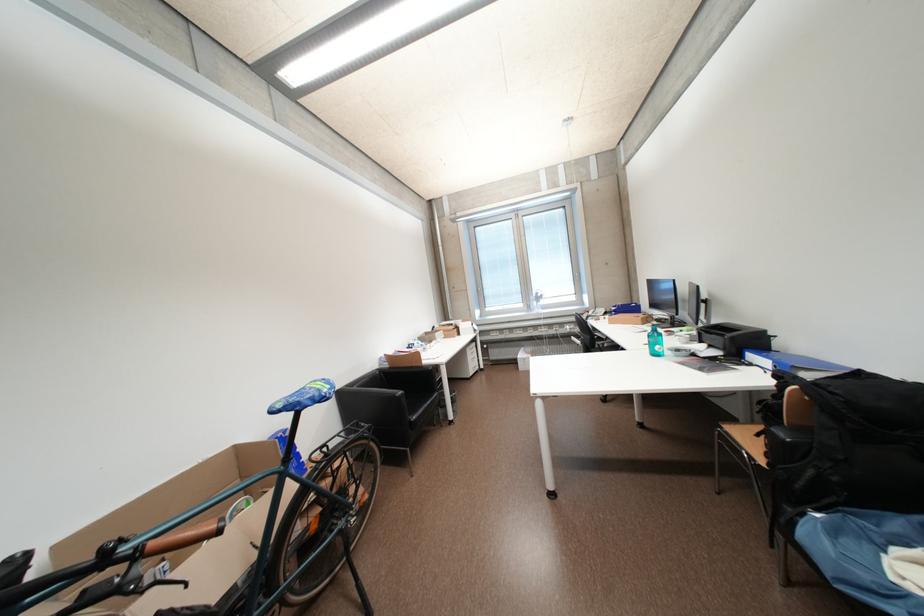
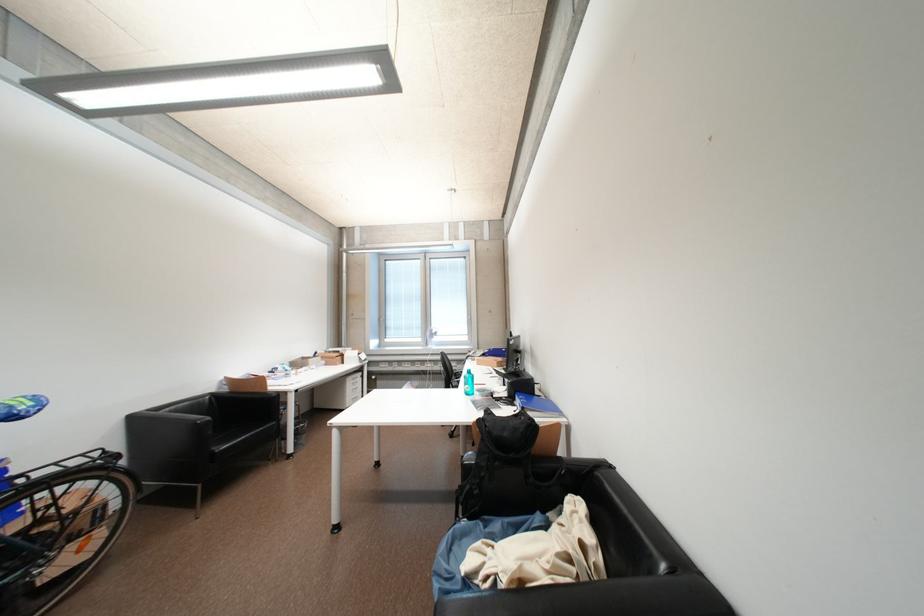
In the second image, find the point that corresponds to (x=477, y=354) in the first image.

(358, 384)